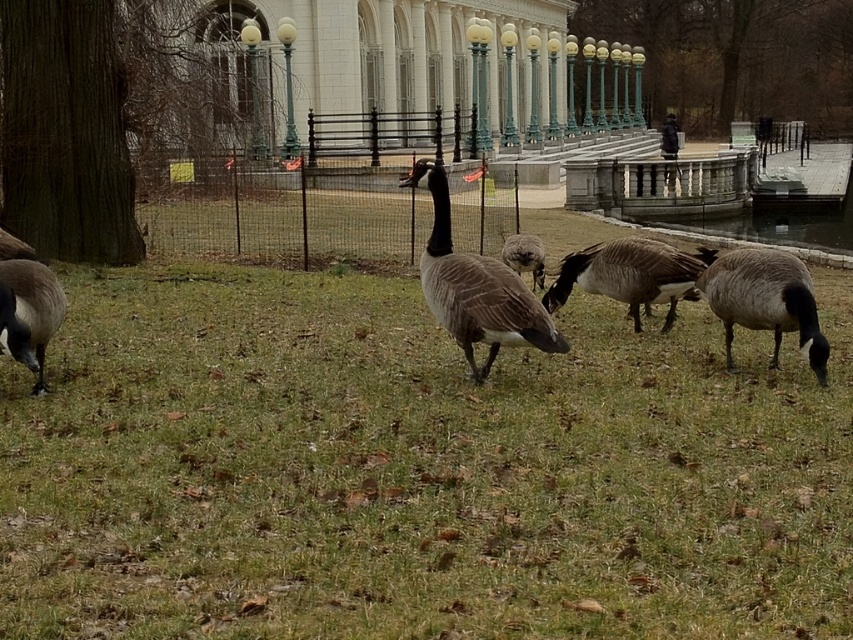
Is metal wire fence at center further to the viewer compared to gray matte goose at center?

No, it is in front of gray matte goose at center.

Can you confirm if metal wire fence at center is positioned to the right of gray matte goose at center?

Incorrect, metal wire fence at center is not on the right side of gray matte goose at center.

This screenshot has width=853, height=640. In order to click on metal wire fence at center in this screenshot , I will do [x=294, y=214].

I want to click on metal wire fence at center, so click(294, 214).

Does point (810, 305) come farther from viewer compared to point (714, 257)?

No.

Is brown feathered goose at center smaller than brown matte duck at center?

Yes.

Is point (788, 296) closer to viewer compared to point (670, 282)?

Yes, point (788, 296) is closer to viewer.

Identify the location of brown feathered goose at center. The height and width of the screenshot is (640, 853). (764, 300).

Does green grassy at center come in front of brown feathered goose at lower left?

Yes, it is in front of brown feathered goose at lower left.

Which is more to the left, green grassy at center or brown feathered goose at lower left?

Positioned to the left is brown feathered goose at lower left.

The height and width of the screenshot is (640, 853). I want to click on green grassy at center, so click(x=413, y=470).